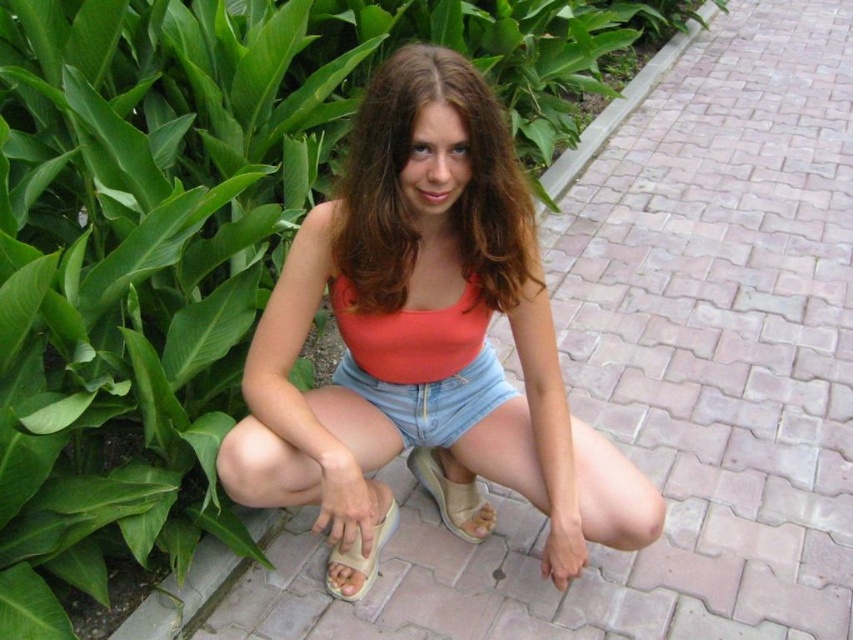
Does matte coral tank top at center have a lesser height compared to matte orange tank top at center?

No, matte coral tank top at center is not shorter than matte orange tank top at center.

Which is more to the left, matte coral tank top at center or matte orange tank top at center?

matte coral tank top at center is more to the left.

Image resolution: width=853 pixels, height=640 pixels. What do you see at coordinates (426, 332) in the screenshot?
I see `matte coral tank top at center` at bounding box center [426, 332].

You are a GUI agent. You are given a task and a screenshot of the screen. Output one action in this format:
    pyautogui.click(x=<x>, y=<y>)
    Task: Click on the matte coral tank top at center
    This screenshot has width=853, height=640.
    Given the screenshot: What is the action you would take?
    pyautogui.click(x=426, y=332)

Who is more distant from viewer, (474, 307) or (370, 573)?

Point (370, 573)

Which is more to the right, matte coral bikini top at center or beige suede sandal at lower center?

matte coral bikini top at center is more to the right.

Which is in front, point (428, 339) or point (380, 532)?

Positioned in front is point (428, 339).

Locate an element on the screen. This screenshot has height=640, width=853. matte coral bikini top at center is located at coordinates (410, 336).

Can you confirm if matte coral bikini top at center is smaller than beige fabric sandal at lower center?

Actually, matte coral bikini top at center might be larger than beige fabric sandal at lower center.

Does point (376, 333) come farther from viewer compared to point (444, 497)?

No, it is not.

Is point (386, 320) behind point (468, 515)?

No, (386, 320) is in front of (468, 515).

Where is `matte coral bikini top at center`? The width and height of the screenshot is (853, 640). matte coral bikini top at center is located at coordinates (410, 336).